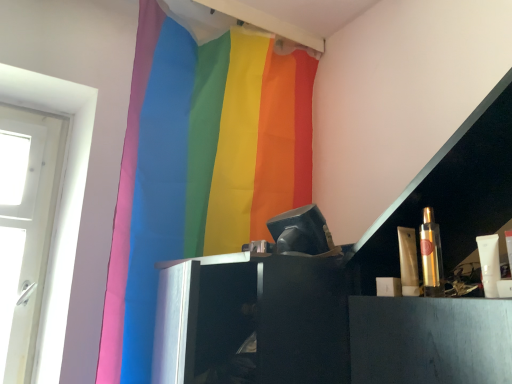
What do you see at coordinates (431, 255) in the screenshot? This screenshot has width=512, height=384. I see `gold metallic spray can at right, placed as the 1th toiletry when sorted from right to left` at bounding box center [431, 255].

The width and height of the screenshot is (512, 384). I want to click on rainbow fabric curtain at upper center, so click(x=161, y=180).

Considering the points (410, 276) and (257, 59), which point is behind, point (410, 276) or point (257, 59)?

The point (257, 59) is behind.

From a real-world perspective, is shiny gold tube at right, which is the first toiletry in left-to-right order, positioned under rainbow fabric curtain at upper center based on gravity?

Yes, from a real-world perspective, shiny gold tube at right, which is the first toiletry in left-to-right order, is below rainbow fabric curtain at upper center.

Considering the relative positions of shiny gold tube at right, which is the first toiletry in left-to-right order, and rainbow fabric curtain at upper center in the image provided, is shiny gold tube at right, which is the first toiletry in left-to-right order, to the left of rainbow fabric curtain at upper center from the viewer's perspective?

No, shiny gold tube at right, which is the first toiletry in left-to-right order, is not to the left of rainbow fabric curtain at upper center.

Is the depth of shiny gold tube at right, which is the first toiletry in left-to-right order, greater than that of rainbow fabric curtain at upper center?

No, the depth of shiny gold tube at right, which is the first toiletry in left-to-right order, is less than that of rainbow fabric curtain at upper center.

Relative to shiny gold tube at right, which is the 2th toiletry from right to left, is rainbow fabric curtain at upper center in front or behind?

Clearly, rainbow fabric curtain at upper center is behind shiny gold tube at right, which is the 2th toiletry from right to left.

How different are the orientations of rainbow fabric curtain at upper center and shiny gold tube at right, which is the 2th toiletry from right to left, in degrees?

There is a 94.5-degree angle between the facing directions of rainbow fabric curtain at upper center and shiny gold tube at right, which is the 2th toiletry from right to left.

Is rainbow fabric curtain at upper center shorter than shiny gold tube at right, which is the first toiletry in left-to-right order?

No.

Could gold metallic spray can at right, positioned as the 2th toiletry in left-to-right order, be considered to be inside rainbow fabric curtain at upper center?

No, rainbow fabric curtain at upper center does not contain gold metallic spray can at right, positioned as the 2th toiletry in left-to-right order.

Considering the relative sizes of rainbow fabric curtain at upper center and gold metallic spray can at right, placed as the 1th toiletry when sorted from right to left, in the image provided, is rainbow fabric curtain at upper center wider than gold metallic spray can at right, placed as the 1th toiletry when sorted from right to left,?

Correct, the width of rainbow fabric curtain at upper center exceeds that of gold metallic spray can at right, placed as the 1th toiletry when sorted from right to left.

From the picture: Which point is more forward, (154,177) or (422,257)?

Positioned in front is point (422,257).

Between rainbow fabric curtain at upper center and gold metallic spray can at right, positioned as the 2th toiletry in left-to-right order, which one has larger size?

rainbow fabric curtain at upper center.

Does gold metallic spray can at right, placed as the 1th toiletry when sorted from right to left, lie behind shiny gold tube at right, which is the first toiletry in left-to-right order?

That is False.

From a real-world perspective, who is located lower, gold metallic spray can at right, placed as the 1th toiletry when sorted from right to left, or shiny gold tube at right, which is the 2th toiletry from right to left?

shiny gold tube at right, which is the 2th toiletry from right to left.

Could you tell me if gold metallic spray can at right, positioned as the 2th toiletry in left-to-right order, is turned towards shiny gold tube at right, which is the first toiletry in left-to-right order?

No, gold metallic spray can at right, positioned as the 2th toiletry in left-to-right order, is not aimed at shiny gold tube at right, which is the first toiletry in left-to-right order.

Considering the positions of objects shiny gold tube at right, which is the 2th toiletry from right to left, and gold metallic spray can at right, positioned as the 2th toiletry in left-to-right order, in the image provided, who is in front, shiny gold tube at right, which is the 2th toiletry from right to left, or gold metallic spray can at right, positioned as the 2th toiletry in left-to-right order,?

gold metallic spray can at right, positioned as the 2th toiletry in left-to-right order.

How many degrees apart are the facing directions of shiny gold tube at right, which is the 2th toiletry from right to left, and gold metallic spray can at right, positioned as the 2th toiletry in left-to-right order?

The angle between the facing direction of shiny gold tube at right, which is the 2th toiletry from right to left, and the facing direction of gold metallic spray can at right, positioned as the 2th toiletry in left-to-right order, is 0.000396 degrees.

Is shiny gold tube at right, which is the 2th toiletry from right to left, shorter than gold metallic spray can at right, placed as the 1th toiletry when sorted from right to left?

Correct, shiny gold tube at right, which is the 2th toiletry from right to left, is not as tall as gold metallic spray can at right, placed as the 1th toiletry when sorted from right to left.

Identify the location of toiletry above the shiny gold tube at right, which is the first toiletry in left-to-right order (from the image's perspective). This screenshot has width=512, height=384. (431, 255).

Is gold metallic spray can at right, positioned as the 2th toiletry in left-to-right order, further to camera compared to rainbow fabric curtain at upper center?

No, gold metallic spray can at right, positioned as the 2th toiletry in left-to-right order, is in front of rainbow fabric curtain at upper center.

Looking at this image, between gold metallic spray can at right, positioned as the 2th toiletry in left-to-right order, and rainbow fabric curtain at upper center, which one has larger size?

rainbow fabric curtain at upper center is bigger.

Considering the sizes of objects gold metallic spray can at right, placed as the 1th toiletry when sorted from right to left, and rainbow fabric curtain at upper center in the image provided, who is wider, gold metallic spray can at right, placed as the 1th toiletry when sorted from right to left, or rainbow fabric curtain at upper center?

rainbow fabric curtain at upper center.

Considering the positions of objects gold metallic spray can at right, placed as the 1th toiletry when sorted from right to left, and rainbow fabric curtain at upper center in the image provided, who is more to the right, gold metallic spray can at right, placed as the 1th toiletry when sorted from right to left, or rainbow fabric curtain at upper center?

gold metallic spray can at right, placed as the 1th toiletry when sorted from right to left.

In order to click on curtain that appears on the left of shiny gold tube at right, which is the first toiletry in left-to-right order in this screenshot , I will do `click(161, 180)`.

Locate an element on the screen. The width and height of the screenshot is (512, 384). curtain above the shiny gold tube at right, which is the 2th toiletry from right to left (from the image's perspective) is located at coordinates (161, 180).

Which object lies further to the anchor point rainbow fabric curtain at upper center, shiny gold tube at right, which is the first toiletry in left-to-right order, or gold metallic spray can at right, positioned as the 2th toiletry in left-to-right order?

gold metallic spray can at right, positioned as the 2th toiletry in left-to-right order, is further to rainbow fabric curtain at upper center.

Looking at the image, which one is located further to gold metallic spray can at right, placed as the 1th toiletry when sorted from right to left, rainbow fabric curtain at upper center or shiny gold tube at right, which is the 2th toiletry from right to left?

rainbow fabric curtain at upper center is further to gold metallic spray can at right, placed as the 1th toiletry when sorted from right to left.

Estimate the real-world distances between objects in this image. Which object is further from rainbow fabric curtain at upper center, gold metallic spray can at right, positioned as the 2th toiletry in left-to-right order, or shiny gold tube at right, which is the 2th toiletry from right to left?

gold metallic spray can at right, positioned as the 2th toiletry in left-to-right order, is positioned further to the anchor rainbow fabric curtain at upper center.

Considering their positions, is gold metallic spray can at right, positioned as the 2th toiletry in left-to-right order, positioned further to shiny gold tube at right, which is the 2th toiletry from right to left, than rainbow fabric curtain at upper center?

Among the two, rainbow fabric curtain at upper center is located further to shiny gold tube at right, which is the 2th toiletry from right to left.

Considering their positions, is shiny gold tube at right, which is the first toiletry in left-to-right order, positioned further to gold metallic spray can at right, positioned as the 2th toiletry in left-to-right order, than rainbow fabric curtain at upper center?

The object further to gold metallic spray can at right, positioned as the 2th toiletry in left-to-right order, is rainbow fabric curtain at upper center.

From the image, which object appears to be farther from shiny gold tube at right, which is the 2th toiletry from right to left, rainbow fabric curtain at upper center or gold metallic spray can at right, placed as the 1th toiletry when sorted from right to left?

rainbow fabric curtain at upper center is further to shiny gold tube at right, which is the 2th toiletry from right to left.

You are a GUI agent. You are given a task and a screenshot of the screen. Output one action in this format:
    pyautogui.click(x=<x>, y=<y>)
    Task: Click on the toiletry between rainbow fabric curtain at upper center and gold metallic spray can at right, placed as the 1th toiletry when sorted from right to left, in the horizontal direction
    
    Given the screenshot: What is the action you would take?
    pyautogui.click(x=408, y=261)